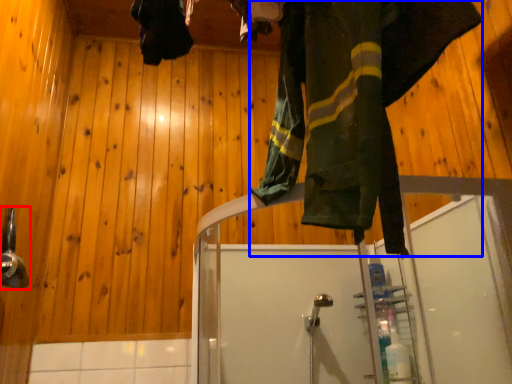
Question: Which object is further to the camera taking this photo, shower (highlighted by a red box) or clothing (highlighted by a blue box)?

Choices:
 (A) shower
 (B) clothing

Answer: (A)